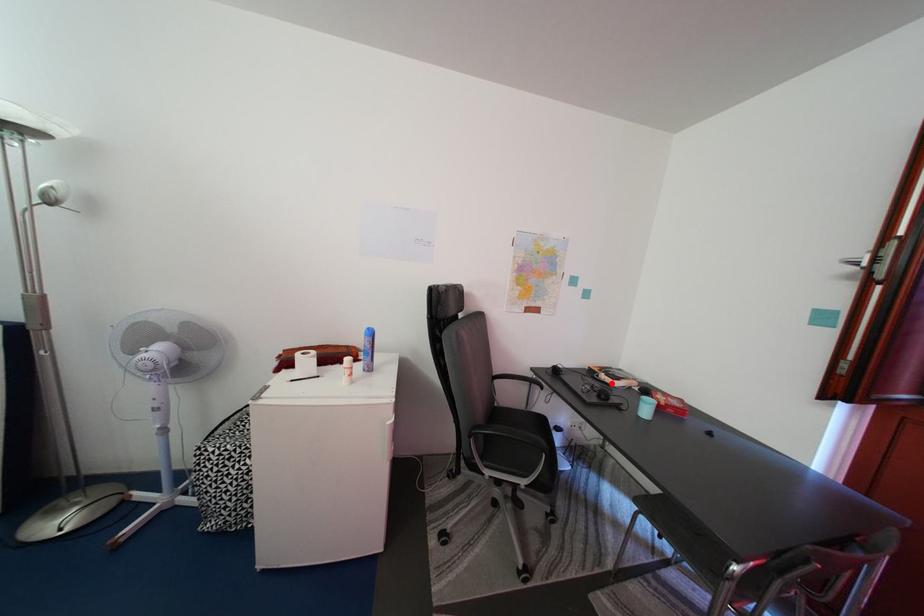
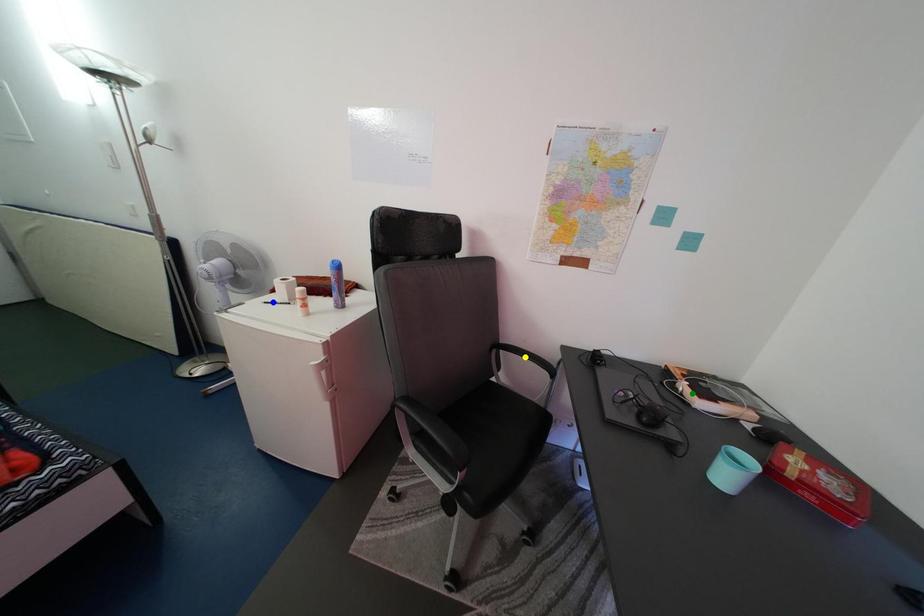
Question: I am providing you with two images of the same scene from different viewpoints. A red point is marked on the first image. You are given multiple points on the second image. Which mark in image 2 goes with the point in image 1?

Choices:
 (A) green point
 (B) blue point
 (C) yellow point

Answer: (A)